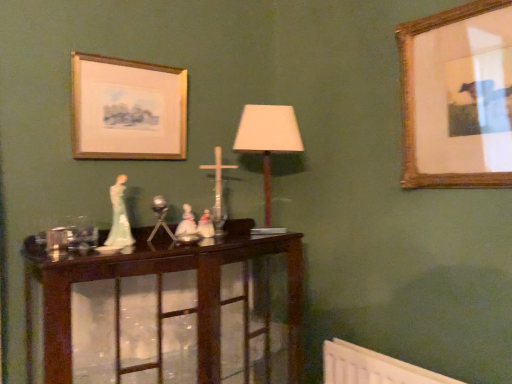
Describe the element at coordinates (458, 97) in the screenshot. This screenshot has height=384, width=512. I see `wooden picture frame at upper right, which is the 1th picture frame in right-to-left order` at that location.

This screenshot has height=384, width=512. I want to click on white porcelain figurines at center, so click(x=186, y=223).

I want to click on dark wood table at center, so click(161, 296).

From a real-world perspective, is wooden picture frame at upper left, arranged as the 1th picture frame when viewed from the left, positioned under wooden picture frame at upper right, arranged as the 2th picture frame when viewed from the left, based on gravity?

No.

Is wooden picture frame at upper left, the 2th picture frame viewed from the right, facing towards wooden picture frame at upper right, arranged as the 2th picture frame when viewed from the left?

No, wooden picture frame at upper left, the 2th picture frame viewed from the right, is not aimed at wooden picture frame at upper right, arranged as the 2th picture frame when viewed from the left.

Is wooden picture frame at upper left, the 2th picture frame viewed from the right, wider than wooden picture frame at upper right, which is the 1th picture frame in right-to-left order?

No.

Does wooden picture frame at upper left, the 2th picture frame viewed from the right, have a smaller size compared to wooden picture frame at upper right, which is the 1th picture frame in right-to-left order?

Yes.

Is white porcelain figurines at center inside the boundaries of dark wood table at center, or outside?

white porcelain figurines at center is not inside dark wood table at center, it's outside.

Is white porcelain figurines at center shorter than dark wood table at center?

Yes, white porcelain figurines at center is shorter than dark wood table at center.

Is white porcelain figurines at center turned away from dark wood table at center?

No, white porcelain figurines at center is not facing the opposite direction of dark wood table at center.

Is point (269, 123) positioned in front of point (195, 226)?

No.

Locate an element on the screen. The height and width of the screenshot is (384, 512). table lamp above the white porcelain figurines at center (from the image's perspective) is located at coordinates (268, 139).

Considering the relative sizes of matte white shade at center and white porcelain figurines at center in the image provided, is matte white shade at center thinner than white porcelain figurines at center?

Incorrect, the width of matte white shade at center is not less than that of white porcelain figurines at center.

From a real-world perspective, is wooden picture frame at upper right, arranged as the 2th picture frame when viewed from the left, positioned under matte white shade at center based on gravity?

Actually, wooden picture frame at upper right, arranged as the 2th picture frame when viewed from the left, is physically above matte white shade at center in the real world.

Which object is wider, wooden picture frame at upper right, which is the 1th picture frame in right-to-left order, or matte white shade at center?

With larger width is matte white shade at center.

Is point (472, 106) positioned behind point (266, 166)?

No, it is in front of (266, 166).

From the image's perspective, between wooden picture frame at upper right, arranged as the 2th picture frame when viewed from the left, and matte white shade at center, which one is located above?

wooden picture frame at upper right, arranged as the 2th picture frame when viewed from the left, from the image's perspective.

In the scene shown: Can you confirm if wooden picture frame at upper left, arranged as the 1th picture frame when viewed from the left, is bigger than matte white shade at center?

No.

Is wooden picture frame at upper left, the 2th picture frame viewed from the right, in front of matte white shade at center?

Yes, the depth of wooden picture frame at upper left, the 2th picture frame viewed from the right, is less than that of matte white shade at center.

Is point (84, 112) behind point (270, 214)?

No, it is in front of (270, 214).

From the image's perspective, is wooden picture frame at upper left, the 2th picture frame viewed from the right, above or below matte white shade at center?

Based on their image positions, wooden picture frame at upper left, the 2th picture frame viewed from the right, is located above matte white shade at center.

From a real-world perspective, is white porcelain figurines at center positioned over wooden picture frame at upper right, which is the 1th picture frame in right-to-left order, based on gravity?

No, from a real-world perspective, white porcelain figurines at center is not on top of wooden picture frame at upper right, which is the 1th picture frame in right-to-left order.

How different are the orientations of white porcelain figurines at center and wooden picture frame at upper right, arranged as the 2th picture frame when viewed from the left, in degrees?

They differ by 90.9 degrees in their facing directions.

Is white porcelain figurines at center next to wooden picture frame at upper right, arranged as the 2th picture frame when viewed from the left?

white porcelain figurines at center and wooden picture frame at upper right, arranged as the 2th picture frame when viewed from the left, are not in contact.

Is dark wood table at center touching wooden picture frame at upper left, the 2th picture frame viewed from the right?

No, dark wood table at center is not with wooden picture frame at upper left, the 2th picture frame viewed from the right.

Which object is wider, dark wood table at center or wooden picture frame at upper left, the 2th picture frame viewed from the right?

Wider between the two is dark wood table at center.

Identify the location of picture frame on the left of the dark wood table at center. (128, 109).

This screenshot has width=512, height=384. What are the coordinates of `picture frame on the left of wooden picture frame at upper right, which is the 1th picture frame in right-to-left order` in the screenshot? It's located at 128,109.

This screenshot has width=512, height=384. In order to click on table in front of the white porcelain figurines at center in this screenshot , I will do `click(161, 296)`.

From the image, which object appears to be farther from matte white shade at center, wooden picture frame at upper right, which is the 1th picture frame in right-to-left order, or wooden picture frame at upper left, the 2th picture frame viewed from the right?

The object further to matte white shade at center is wooden picture frame at upper right, which is the 1th picture frame in right-to-left order.

Based on their spatial positions, is white porcelain figurines at center or wooden picture frame at upper left, the 2th picture frame viewed from the right, closer to dark wood table at center?

Among the two, white porcelain figurines at center is located nearer to dark wood table at center.

Based on their spatial positions, is wooden picture frame at upper right, arranged as the 2th picture frame when viewed from the left, or dark wood table at center further from matte white shade at center?

wooden picture frame at upper right, arranged as the 2th picture frame when viewed from the left, lies further to matte white shade at center than the other object.

Based on their spatial positions, is dark wood table at center or wooden picture frame at upper left, the 2th picture frame viewed from the right, further from matte white shade at center?

dark wood table at center.

Estimate the real-world distances between objects in this image. Which object is closer to matte white shade at center, dark wood table at center or wooden picture frame at upper right, which is the 1th picture frame in right-to-left order?

dark wood table at center lies closer to matte white shade at center than the other object.

Estimate the real-world distances between objects in this image. Which object is closer to white porcelain figurines at center, matte white shade at center or wooden picture frame at upper right, which is the 1th picture frame in right-to-left order?

The object closer to white porcelain figurines at center is matte white shade at center.

Based on the photo, which object lies nearer to the anchor point wooden picture frame at upper left, the 2th picture frame viewed from the right, white porcelain figurines at center or matte white shade at center?

matte white shade at center lies closer to wooden picture frame at upper left, the 2th picture frame viewed from the right, than the other object.

Based on their spatial positions, is wooden picture frame at upper right, arranged as the 2th picture frame when viewed from the left, or matte white shade at center further from dark wood table at center?

wooden picture frame at upper right, arranged as the 2th picture frame when viewed from the left, is further to dark wood table at center.

What are the coordinates of `table lamp between white porcelain figurines at center and wooden picture frame at upper right, arranged as the 2th picture frame when viewed from the left` in the screenshot? It's located at (268, 139).

What are the coordinates of `table lamp situated between wooden picture frame at upper left, arranged as the 1th picture frame when viewed from the left, and wooden picture frame at upper right, arranged as the 2th picture frame when viewed from the left, from left to right` in the screenshot? It's located at coord(268,139).

You are a GUI agent. You are given a task and a screenshot of the screen. Output one action in this format:
    pyautogui.click(x=<x>, y=<y>)
    Task: Click on the toy between dark wood table at center and matte white shade at center along the z-axis
    
    Given the screenshot: What is the action you would take?
    pyautogui.click(x=186, y=223)

The width and height of the screenshot is (512, 384). I want to click on toy between wooden picture frame at upper left, the 2th picture frame viewed from the right, and dark wood table at center vertically, so click(x=186, y=223).